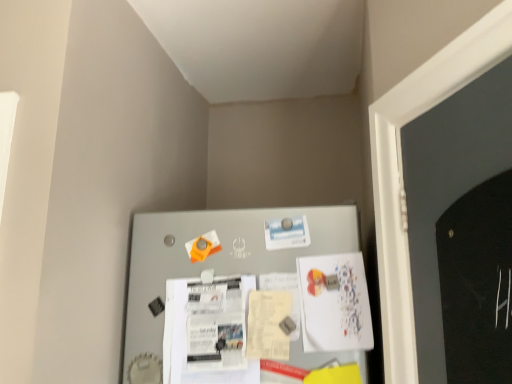
Question: From a real-world perspective, is white paper poster at center, which appears as the second poster when viewed from the left, under metallic gray bulletin board at center?

Choices:
 (A) yes
 (B) no

Answer: (A)

Question: Is white paper poster at center, the first poster when ordered from right to left, at the right side of metallic gray bulletin board at center?

Choices:
 (A) yes
 (B) no

Answer: (A)

Question: From a real-world perspective, is white paper poster at center, the first poster when ordered from right to left, on metallic gray bulletin board at center?

Choices:
 (A) no
 (B) yes

Answer: (A)

Question: Is white paper poster at center, the first poster when ordered from right to left, looking in the opposite direction of metallic gray bulletin board at center?

Choices:
 (A) yes
 (B) no

Answer: (A)

Question: Does white paper poster at center, the first poster when ordered from right to left, have a larger size compared to metallic gray bulletin board at center?

Choices:
 (A) yes
 (B) no

Answer: (B)

Question: Is white paper poster at center, the first poster when ordered from right to left, to the left of metallic gray bulletin board at center from the viewer's perspective?

Choices:
 (A) no
 (B) yes

Answer: (A)

Question: Does metallic gray bulletin board at center lie in front of white paper poster at center, which appears as the second poster when viewed from the left?

Choices:
 (A) yes
 (B) no

Answer: (A)

Question: Would you say metallic gray bulletin board at center contains white paper poster at center, the first poster when ordered from right to left?

Choices:
 (A) yes
 (B) no

Answer: (A)

Question: From the image's perspective, is metallic gray bulletin board at center over white paper poster at center, which appears as the second poster when viewed from the left?

Choices:
 (A) no
 (B) yes

Answer: (B)

Question: Can you confirm if metallic gray bulletin board at center is bigger than white paper poster at center, the first poster when ordered from right to left?

Choices:
 (A) no
 (B) yes

Answer: (B)

Question: Considering the relative sizes of metallic gray bulletin board at center and white paper poster at center, the first poster when ordered from right to left, in the image provided, is metallic gray bulletin board at center thinner than white paper poster at center, the first poster when ordered from right to left,?

Choices:
 (A) no
 (B) yes

Answer: (A)

Question: Could you tell me if metallic gray bulletin board at center is turned towards white paper poster at center, which appears as the second poster when viewed from the left?

Choices:
 (A) yes
 (B) no

Answer: (A)

Question: Can you confirm if white paper poster at center, positioned as the 1th poster in left-to-right order, is shorter than metallic gray bulletin board at center?

Choices:
 (A) yes
 (B) no

Answer: (A)